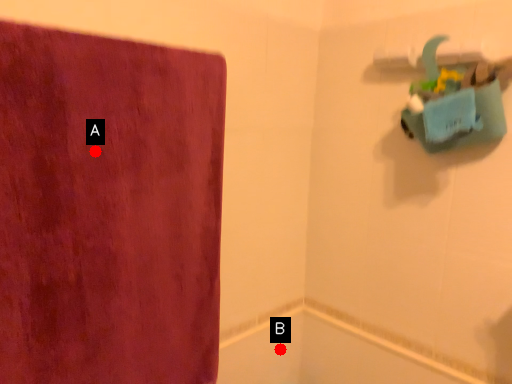
Question: Two points are circled on the image, labeled by A and B beside each circle. Among these points, which one is farthest from the camera?

Choices:
 (A) A is further
 (B) B is further

Answer: (B)